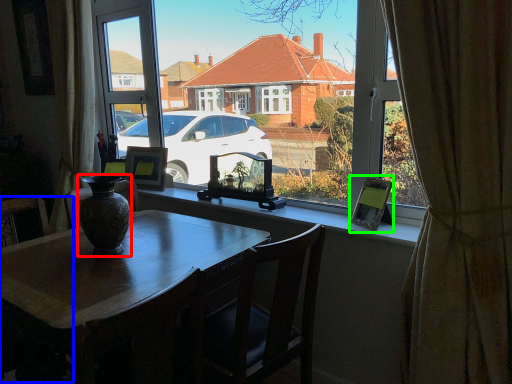
Question: Which is farther away from vase (highlighted by a red box)? armchair (highlighted by a blue box) or picture frame (highlighted by a green box)?

Choices:
 (A) armchair
 (B) picture frame

Answer: (A)